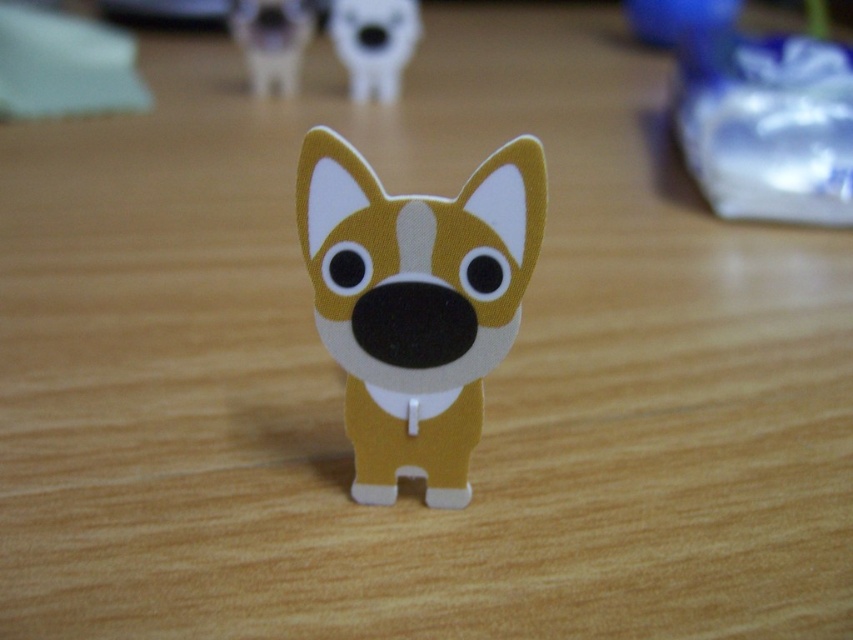
Question: Can you confirm if matte cardboard dog at center is positioned to the left of matte plastic dog at upper center?

Choices:
 (A) no
 (B) yes

Answer: (A)

Question: Based on their relative distances, which object is farther from the matte plastic dog at upper center?

Choices:
 (A) matte cardboard dog at upper center
 (B) matte cardboard dog at center

Answer: (B)

Question: Does matte cardboard dog at center appear on the right side of matte cardboard dog at upper center?

Choices:
 (A) no
 (B) yes

Answer: (B)

Question: Does matte cardboard dog at center have a larger size compared to matte cardboard dog at upper center?

Choices:
 (A) yes
 (B) no

Answer: (A)

Question: Among these points, which one is nearest to the camera?

Choices:
 (A) (259, 42)
 (B) (370, 10)

Answer: (B)

Question: Among these points, which one is farthest from the camera?

Choices:
 (A) (370, 339)
 (B) (305, 44)

Answer: (B)